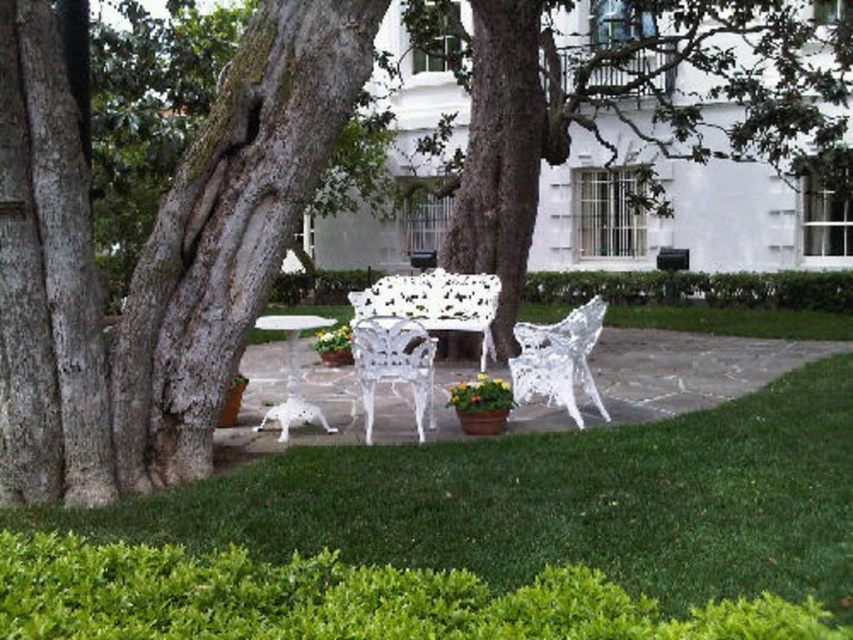
You are standing at the camera position and want to walk to point (451, 298). Is the distance more than 10 meters?

Yes, the distance between the camera and point (451, 298) is 11.33 meters, which is more than 10 meters.

Consider the image. You are planning to set up a small garden party and need to arrange the white lace chair at center and the white glossy table at center. Based on the garden layout, which object should you place first to ensure proper positioning?

The white lace chair at center should be placed first since it is positioned below the white glossy table at center, indicating it needs to be under or near the table for proper arrangement.